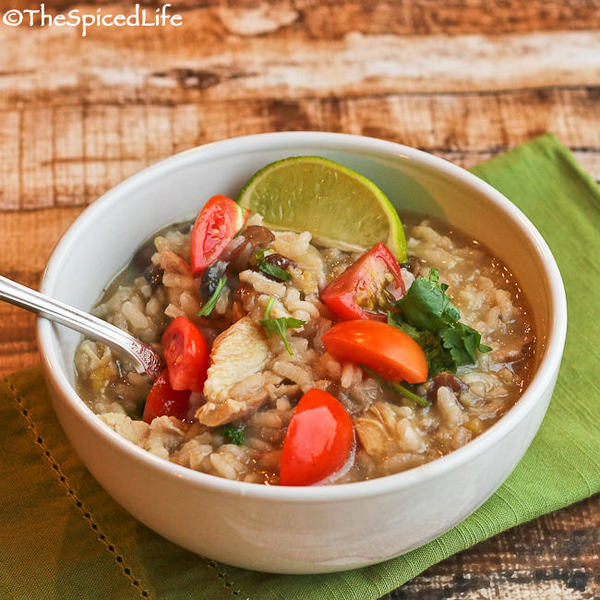
Where is `spoon`? spoon is located at coordinates (49, 315).